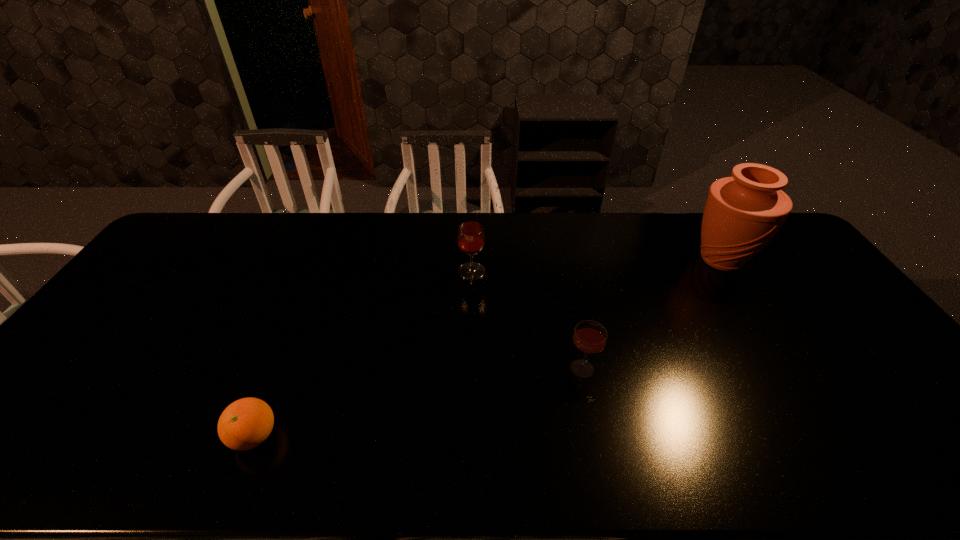
This screenshot has height=540, width=960. Identify the location of vase. (743, 213).

I want to click on the tallest object, so [743, 213].

What are the coordinates of `the farther wineglass` in the screenshot? It's located at (471, 238).

This screenshot has width=960, height=540. What are the coordinates of `the third shortest object` in the screenshot? It's located at (471, 238).

Find the location of a particular element. The image size is (960, 540). the nearer wineglass is located at coordinates (589, 337).

The width and height of the screenshot is (960, 540). I want to click on the second object from right to left, so click(589, 337).

This screenshot has height=540, width=960. In order to click on the shortest object in this screenshot , I will do [x=246, y=423].

Find the location of a particular element. This screenshot has height=540, width=960. the nearest object is located at coordinates (246, 423).

Where is `free spot located on the front of the rightmost object`? free spot located on the front of the rightmost object is located at coordinates (769, 336).

The width and height of the screenshot is (960, 540). Find the location of `vacant space located on the front of the farther wineglass`. vacant space located on the front of the farther wineglass is located at coordinates (469, 362).